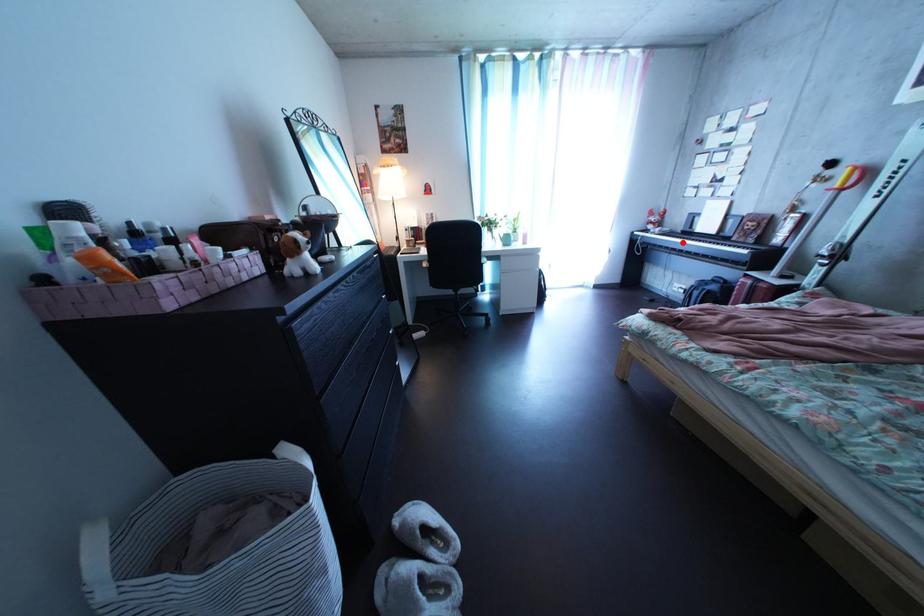
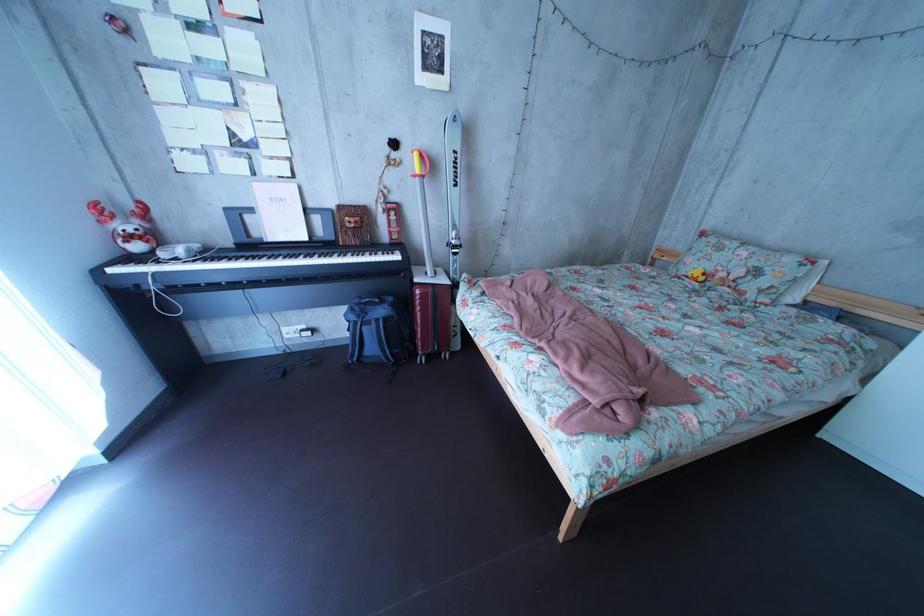
Question: I am providing you with two images of the same scene from different viewpoints. Given a red point in image1, look at the same physical point in image2. Is it:

Choices:
 (A) Closer to the viewpoint
 (B) Farther from the viewpoint

Answer: (A)